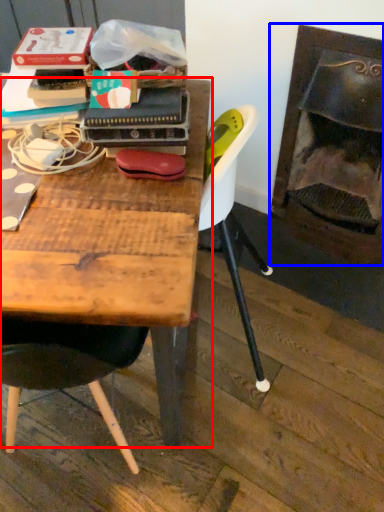
Question: Among these objects, which one is farthest to the camera, table (highlighted by a red box) or fireplace (highlighted by a blue box)?

Choices:
 (A) table
 (B) fireplace

Answer: (B)